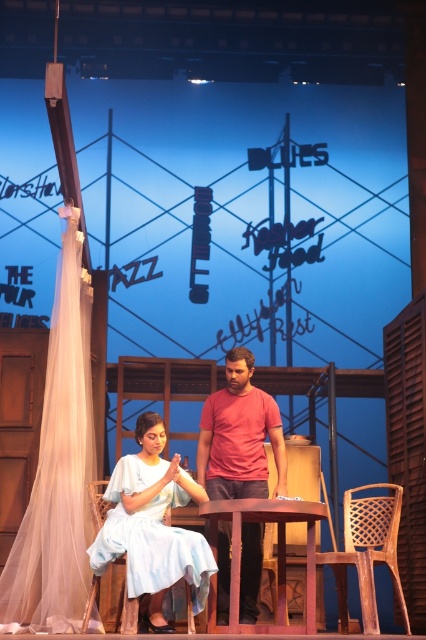
Question: Is white cotton dress at center wider than matte red t-shirt at center?

Choices:
 (A) yes
 (B) no

Answer: (A)

Question: Is white cotton dress at center positioned at the back of wooden table at center?

Choices:
 (A) yes
 (B) no

Answer: (A)

Question: Considering the relative positions of white cotton dress at center and matte red t-shirt at center in the image provided, where is white cotton dress at center located with respect to matte red t-shirt at center?

Choices:
 (A) left
 (B) right

Answer: (A)

Question: Which object appears closest to the camera in this image?

Choices:
 (A) white cotton dress at center
 (B) wooden table at center

Answer: (B)

Question: Which point is farther to the camera?

Choices:
 (A) wooden table at center
 (B) white cotton dress at center

Answer: (B)

Question: Among these objects, which one is nearest to the camera?

Choices:
 (A) white cotton dress at center
 (B) wooden table at center

Answer: (B)